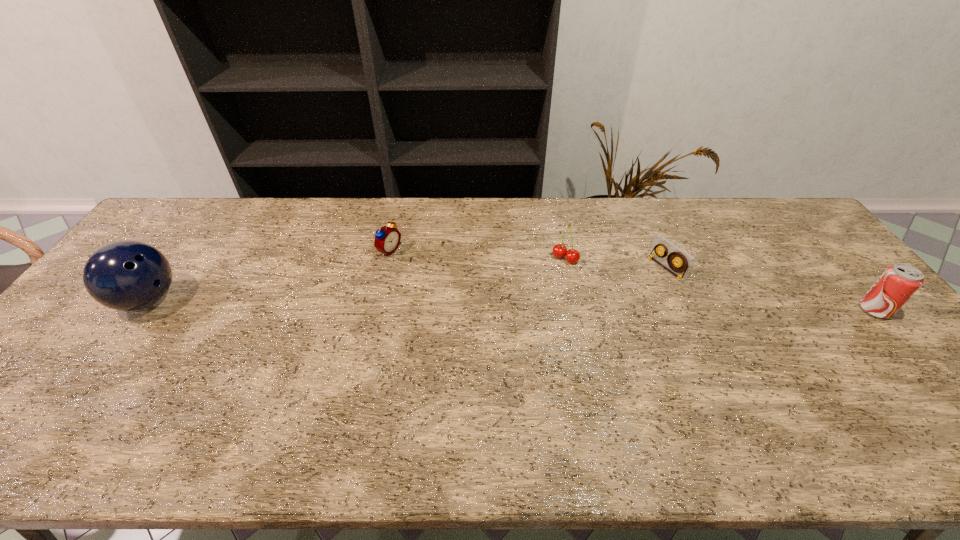
Identify the location of free spot between the fourth object from left to right and the tallest object. (406, 284).

You are a GUI agent. You are given a task and a screenshot of the screen. Output one action in this format:
    pyautogui.click(x=<x>, y=<y>)
    Task: Click on the free area in between the second tallest object and the leftmost object
    This screenshot has height=540, width=960.
    Given the screenshot: What is the action you would take?
    pyautogui.click(x=511, y=305)

Image resolution: width=960 pixels, height=540 pixels. In order to click on vacant space that's between the second object from left to right and the cherry in this screenshot , I will do `click(477, 255)`.

Identify the location of empty space that is in between the fourth object from right to left and the tallest object. Image resolution: width=960 pixels, height=540 pixels. (269, 275).

Locate which object is the third closest to the third object from right to left. Please provide its 2D coordinates. Your answer should be formatted as a tuple, i.e. [(x, y)], where the tuple contains the x and y coordinates of a point satisfying the conditions above.

[(899, 282)]

Select which object appears as the third closest to the soda can. Please provide its 2D coordinates. Your answer should be formatted as a tuple, i.e. [(x, y)], where the tuple contains the x and y coordinates of a point satisfying the conditions above.

[(387, 239)]